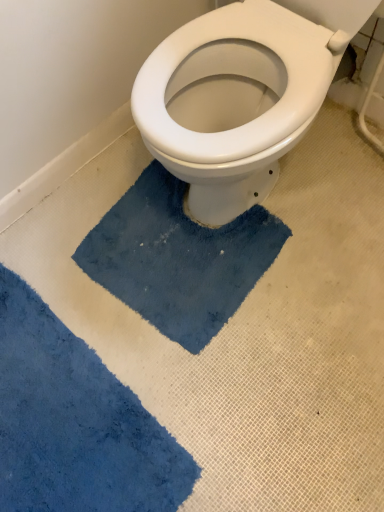
Identify the location of free space below blue plush bath mat at center, which is the second bath mat in bottom-to-top order (from a real-world perspective). The width and height of the screenshot is (384, 512). (155, 269).